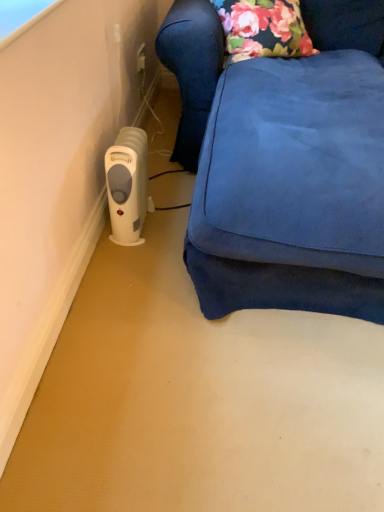
Question: Is white plastic heater at left turned away from white plastic heater at lower left?

Choices:
 (A) no
 (B) yes

Answer: (A)

Question: Is white plastic heater at left at the left side of white plastic heater at lower left?

Choices:
 (A) no
 (B) yes

Answer: (A)

Question: Can white plastic heater at lower left be found inside white plastic heater at left?

Choices:
 (A) yes
 (B) no

Answer: (A)

Question: Would you say white plastic heater at left is a long distance from white plastic heater at lower left?

Choices:
 (A) yes
 (B) no

Answer: (B)

Question: From the image's perspective, does white plastic heater at left appear higher than white plastic heater at lower left?

Choices:
 (A) yes
 (B) no

Answer: (A)

Question: Is white plastic heater at left next to white plastic heater at lower left?

Choices:
 (A) no
 (B) yes

Answer: (A)

Question: Is the position of white plastic heater at lower left more distant than that of white plastic heater at left?

Choices:
 (A) no
 (B) yes

Answer: (B)

Question: Can you confirm if white plastic heater at lower left is smaller than white plastic heater at left?

Choices:
 (A) no
 (B) yes

Answer: (B)

Question: Does white plastic heater at lower left have a greater width compared to white plastic heater at left?

Choices:
 (A) no
 (B) yes

Answer: (A)

Question: Is white plastic heater at lower left oriented away from white plastic heater at left?

Choices:
 (A) yes
 (B) no

Answer: (B)

Question: Is white plastic heater at left inside white plastic heater at lower left?

Choices:
 (A) yes
 (B) no

Answer: (B)

Question: From the image's perspective, is white plastic heater at lower left located above white plastic heater at left?

Choices:
 (A) no
 (B) yes

Answer: (A)

Question: Would you say white plastic heater at lower left is to the left or to the right of white plastic heater at left in the picture?

Choices:
 (A) left
 (B) right

Answer: (A)